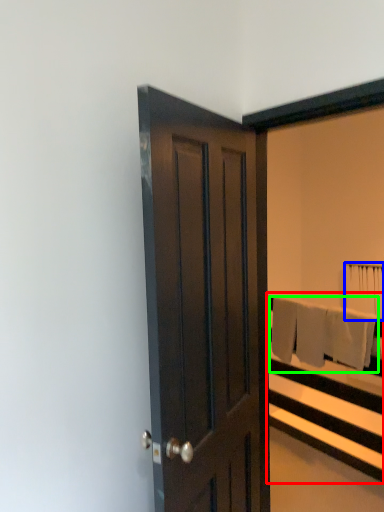
Question: Which object is the closest to the bed frame (highlighted by a red box)? Choose among these: bath towel (highlighted by a blue box) or bath towel (highlighted by a green box).

Choices:
 (A) bath towel
 (B) bath towel

Answer: (B)